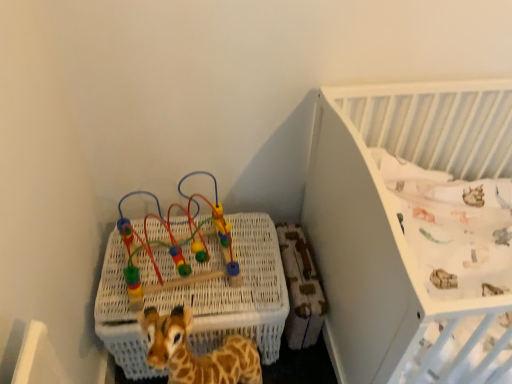
Where is `free space above white wicker basket at lower left (from a real-world perspective)`? free space above white wicker basket at lower left (from a real-world perspective) is located at coordinates (185, 270).